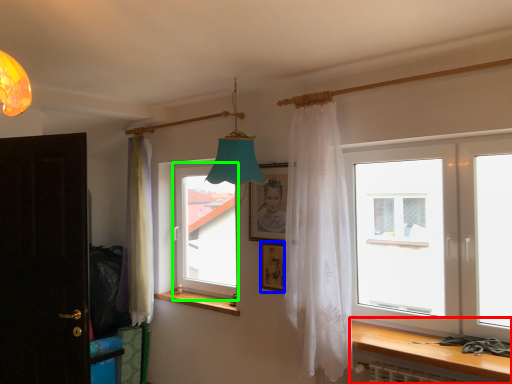
Question: Estimate the real-world distances between objects in this image. Which object is closer to table (highlighted by a red box), picture frame (highlighted by a blue box) or window (highlighted by a green box)?

Choices:
 (A) picture frame
 (B) window

Answer: (A)